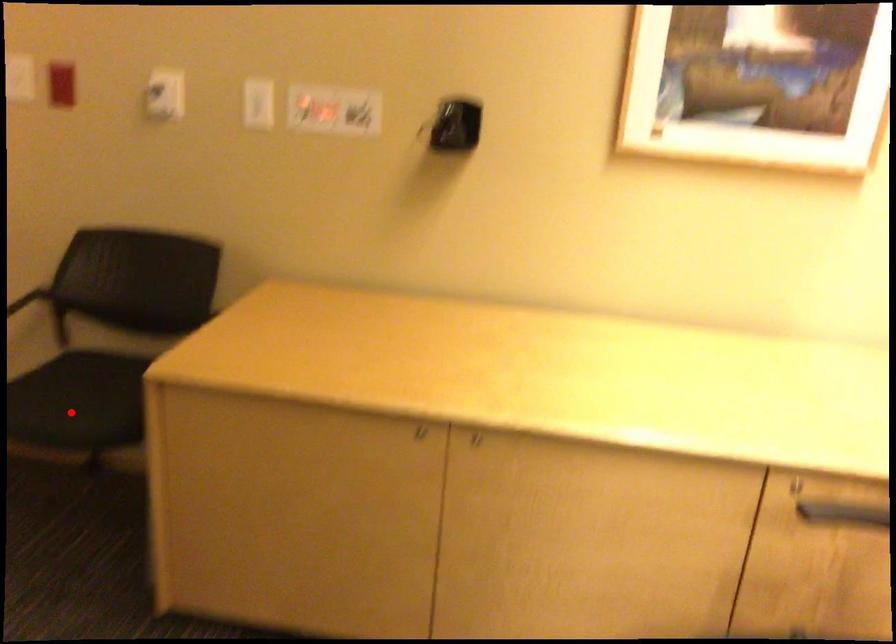
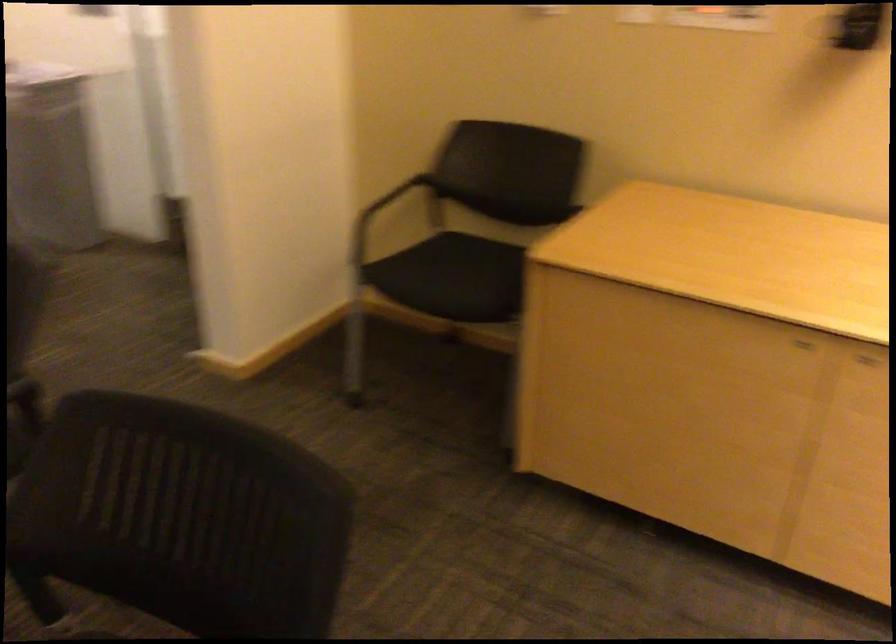
In the second image, find the point that corresponds to the highlighted location in the first image.

(446, 275)